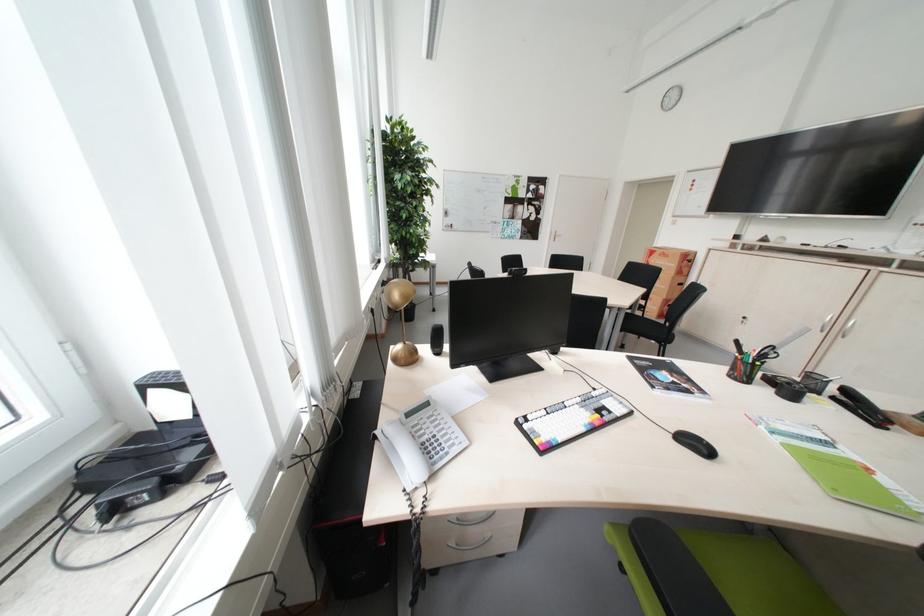
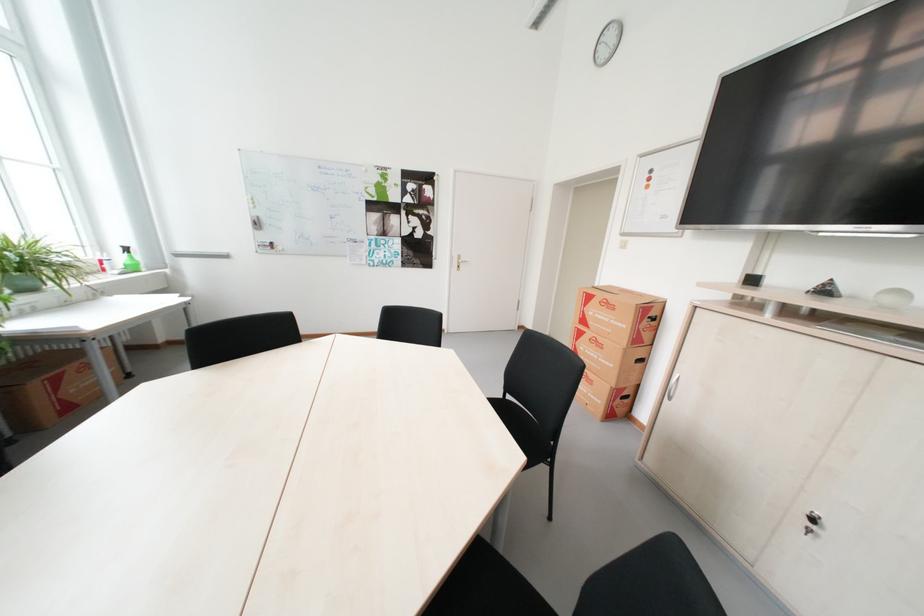
Locate, in the second image, the point that corresponds to (x=774, y=241) in the first image.

(835, 292)